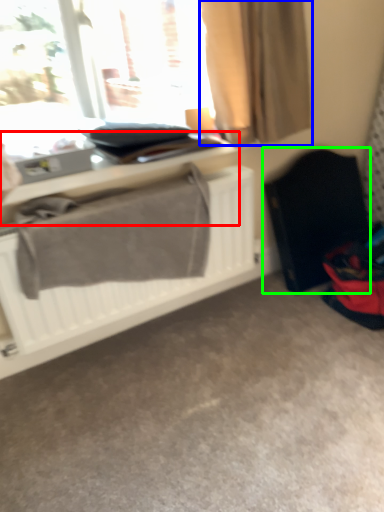
Question: Which object is the farthest from table (highlighted by a red box)? Choose among these: curtain (highlighted by a blue box) or folding chair (highlighted by a green box).

Choices:
 (A) curtain
 (B) folding chair

Answer: (B)